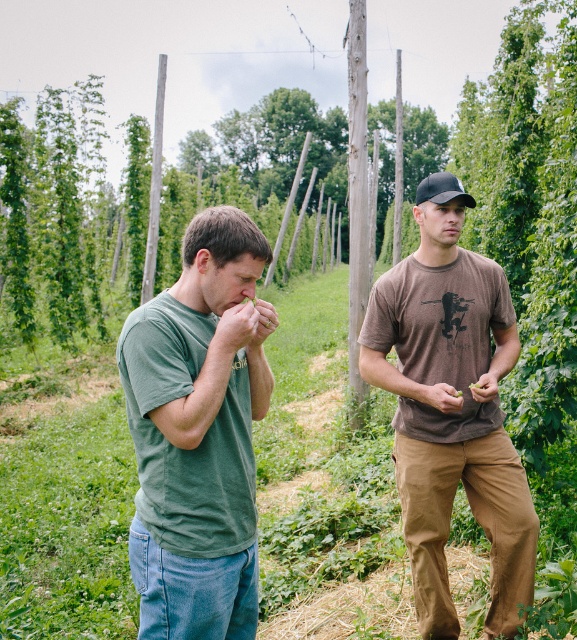
Question: Among these objects, which one is farthest from the camera?

Choices:
 (A) green cotton shirt at center
 (B) brown cotton t-shirt at center
 (C) black matte baseball hat at upper right
 (D) green cotton shirt at left

Answer: (C)

Question: Among these objects, which one is nearest to the camera?

Choices:
 (A) green cotton shirt at center
 (B) black matte baseball hat at upper right
 (C) brown cotton t-shirt at center
 (D) green cotton shirt at left

Answer: (D)

Question: Among these points, which one is nearest to the camera?

Choices:
 (A) (444, 200)
 (B) (219, 492)

Answer: (B)

Question: Can you confirm if green cotton shirt at center is bigger than brown cotton t-shirt at center?

Choices:
 (A) yes
 (B) no

Answer: (B)

Question: Observing the image, what is the correct spatial positioning of brown cotton t-shirt at center in reference to black matte baseball hat at upper right?

Choices:
 (A) below
 (B) above

Answer: (A)

Question: Can you confirm if green cotton shirt at center is positioned to the right of brown cotton t-shirt at center?

Choices:
 (A) no
 (B) yes

Answer: (A)